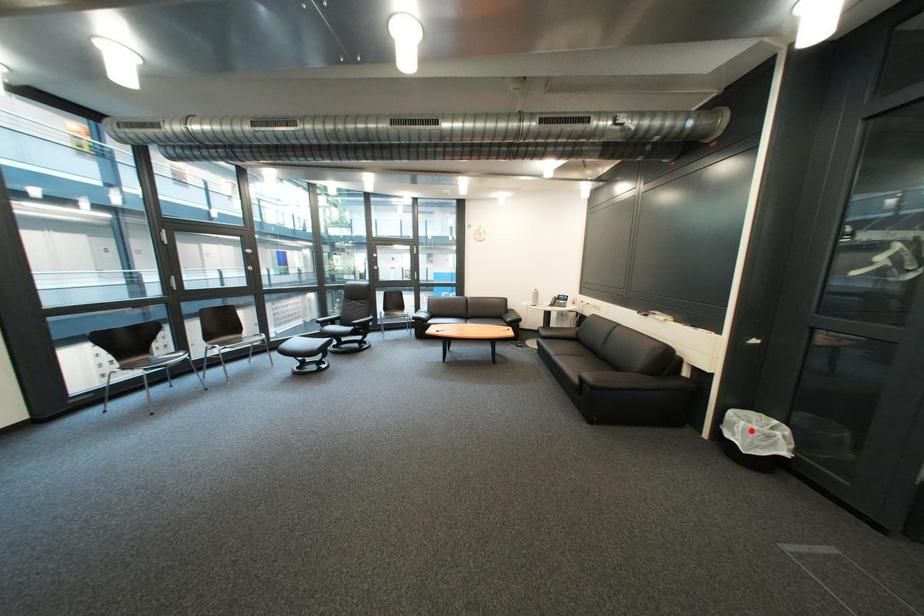
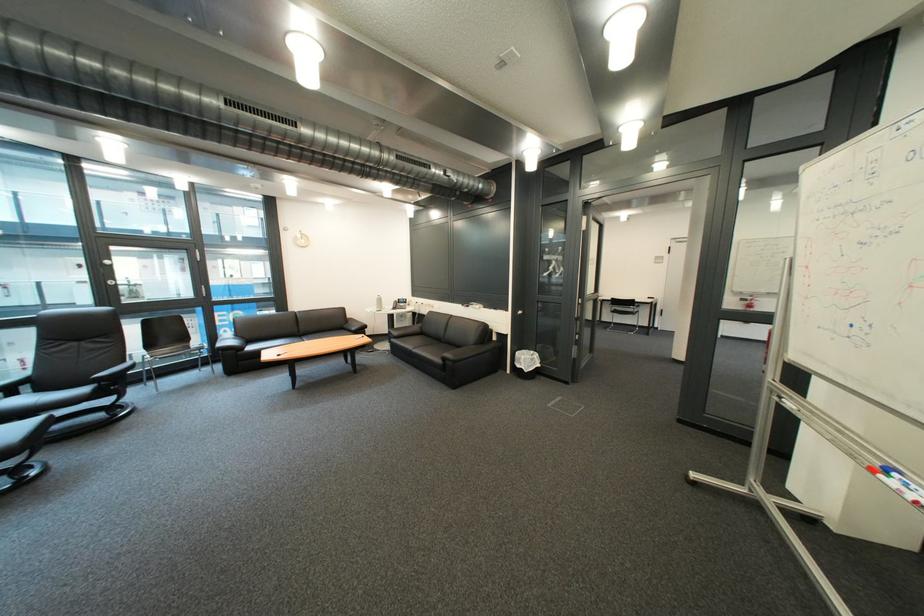
Where in the second image is the point corresponding to the highlighted location from the first image?

(536, 363)